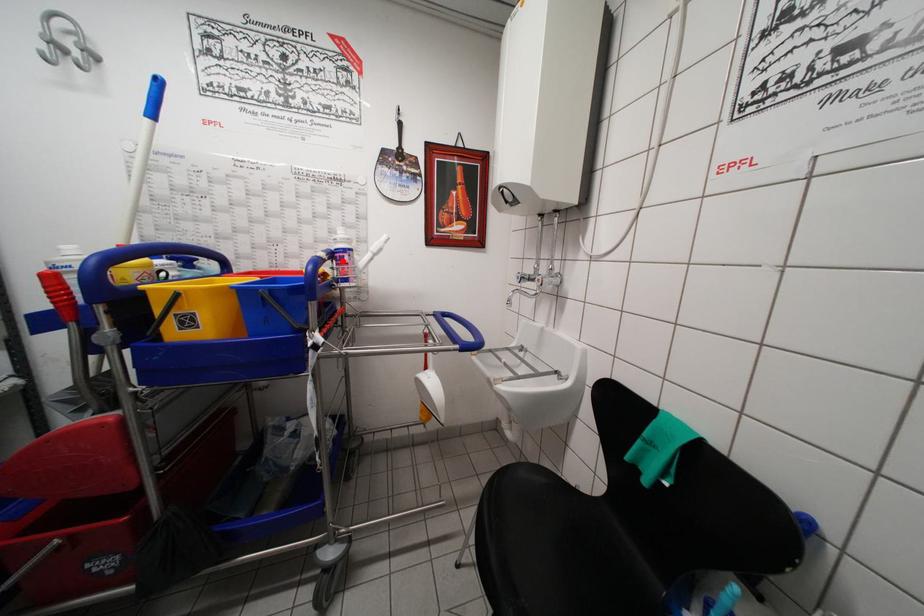
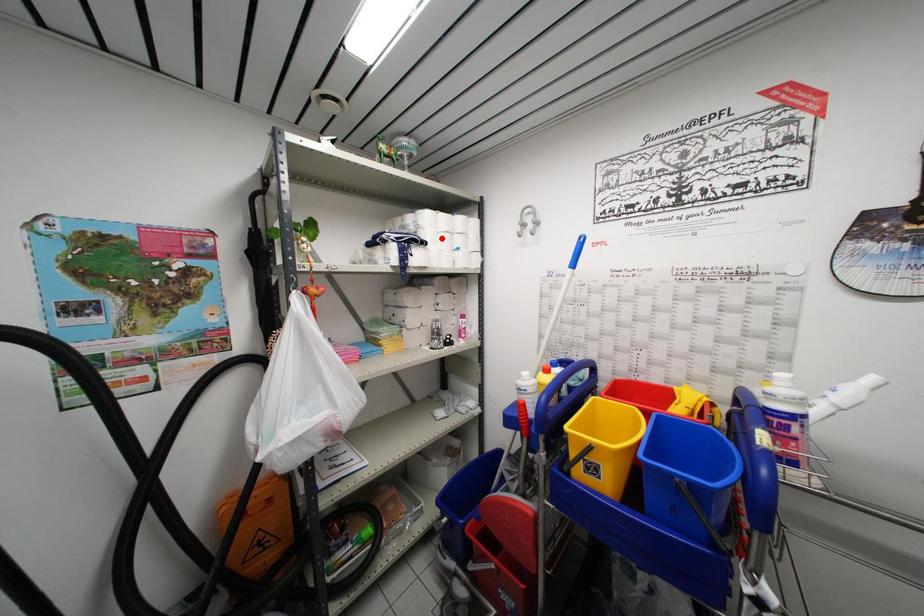
I am providing you with two images of the same scene from different viewpoints. A red point is marked on the first image and another point is marked on the second image. Is the red point in image1 aligned with the point shown in image2?

No